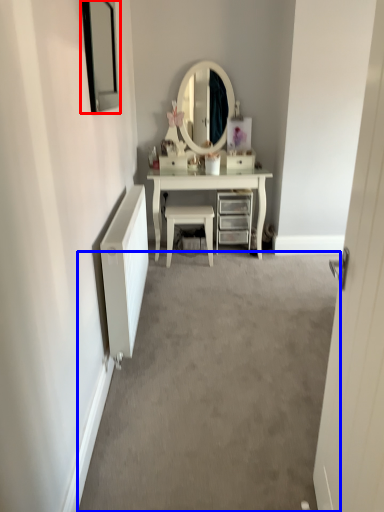
Question: Among these objects, which one is farthest to the camera, picture frame (highlighted by a red box) or plain (highlighted by a blue box)?

Choices:
 (A) picture frame
 (B) plain

Answer: (A)